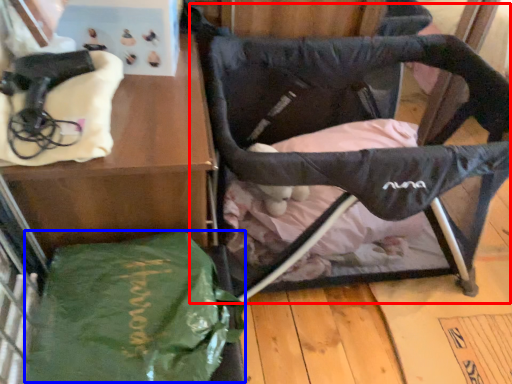
Question: Which point is further to the camera, swivel chair (highlighted by a red box) or tote bag (highlighted by a blue box)?

Choices:
 (A) swivel chair
 (B) tote bag

Answer: (A)